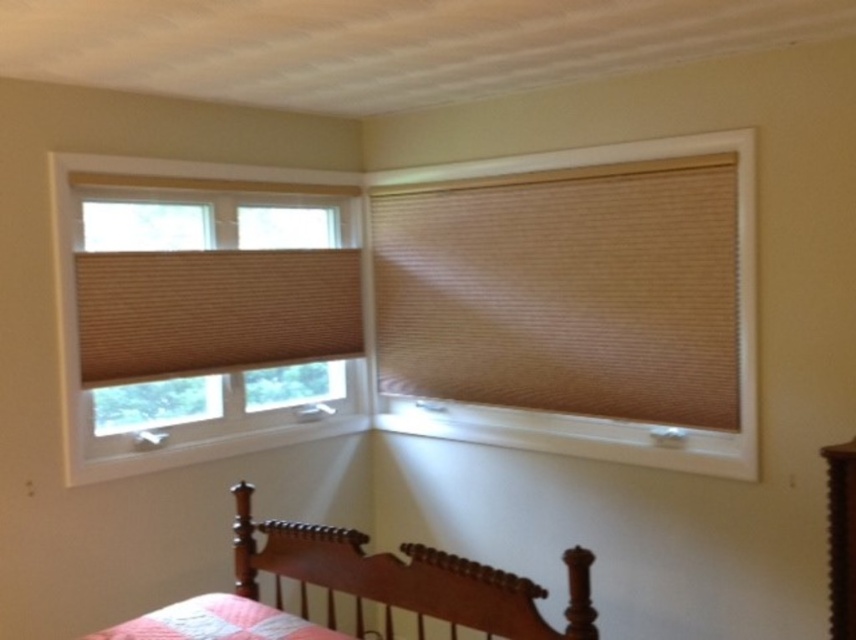
You are standing in the room and want to locate the beige textured blind at upper right. According to the coordinates provided, where should you look?

The beige textured blind at upper right is located at point (565, 291).

You are standing in the room and want to see the wooden dresser at lower right. Is the tan woven blind at left blocking your view of it?

The tan woven blind at left is above the wooden dresser at lower right, so it is blocking the view of the wooden dresser at lower right.

You are standing in the room and want to know which object is taller between the tan woven blind at left and the wooden dresser at lower right. Can you determine this based on their positions?

The tan woven blind at left has a greater height compared to the wooden dresser at lower right, so the tan woven blind at left is taller.